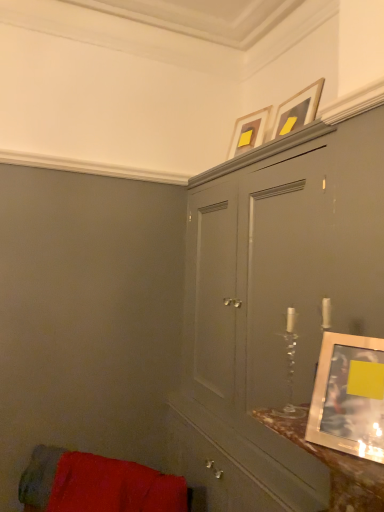
Question: Which direction should I rotate to look at matte gold picture frame at upper center, marked as the third picture frame in a front-to-back arrangement?

Choices:
 (A) right
 (B) left

Answer: (A)

Question: Are velvet red cushion at lower left and matte gold picture frame at upper center, the first picture frame in the top-to-bottom sequence, beside each other?

Choices:
 (A) no
 (B) yes

Answer: (A)

Question: From a real-world perspective, does velvet red cushion at lower left stand above matte gold picture frame at upper center, the first picture frame in the top-to-bottom sequence?

Choices:
 (A) no
 (B) yes

Answer: (A)

Question: Can you confirm if velvet red cushion at lower left is positioned to the right of matte gold picture frame at upper center, the first picture frame in the top-to-bottom sequence?

Choices:
 (A) yes
 (B) no

Answer: (B)

Question: Is matte gold picture frame at upper center, marked as the third picture frame in a front-to-back arrangement, inside velvet red cushion at lower left?

Choices:
 (A) no
 (B) yes

Answer: (A)

Question: Would you say velvet red cushion at lower left is outside matte gold picture frame at upper center, the first picture frame in the top-to-bottom sequence?

Choices:
 (A) yes
 (B) no

Answer: (A)

Question: Can you confirm if velvet red cushion at lower left is positioned to the left of matte gold picture frame at upper center, marked as the third picture frame in a front-to-back arrangement?

Choices:
 (A) yes
 (B) no

Answer: (A)

Question: From the image's perspective, is matte silver picture frame at upper center, the second picture frame when ordered from back to front, under metallic silver picture frame at right, which is the third picture frame in back-to-front order?

Choices:
 (A) yes
 (B) no

Answer: (B)

Question: Can you confirm if matte silver picture frame at upper center, the second picture frame when ordered from back to front, is taller than metallic silver picture frame at right, which is the third picture frame in back-to-front order?

Choices:
 (A) no
 (B) yes

Answer: (A)

Question: Could metallic silver picture frame at right, which is the first picture frame from bottom to top, be considered to be inside matte silver picture frame at upper center, positioned as the second picture frame in bottom-to-top order?

Choices:
 (A) no
 (B) yes

Answer: (A)

Question: Is matte silver picture frame at upper center, which is the second picture frame in front-to-back order, further to the viewer compared to metallic silver picture frame at right, which is the third picture frame in back-to-front order?

Choices:
 (A) no
 (B) yes

Answer: (B)

Question: Can we say matte silver picture frame at upper center, marked as the 2th picture frame in a top-to-bottom arrangement, lies outside metallic silver picture frame at right, which is the third picture frame in back-to-front order?

Choices:
 (A) no
 (B) yes

Answer: (B)

Question: From a real-world perspective, does matte silver picture frame at upper center, which is the second picture frame in front-to-back order, stand above metallic silver picture frame at right, which is the first picture frame from bottom to top?

Choices:
 (A) yes
 (B) no

Answer: (A)

Question: Is matte gold picture frame at upper center, the first picture frame viewed from the back, bigger than matte gray cabinet at upper center?

Choices:
 (A) no
 (B) yes

Answer: (A)